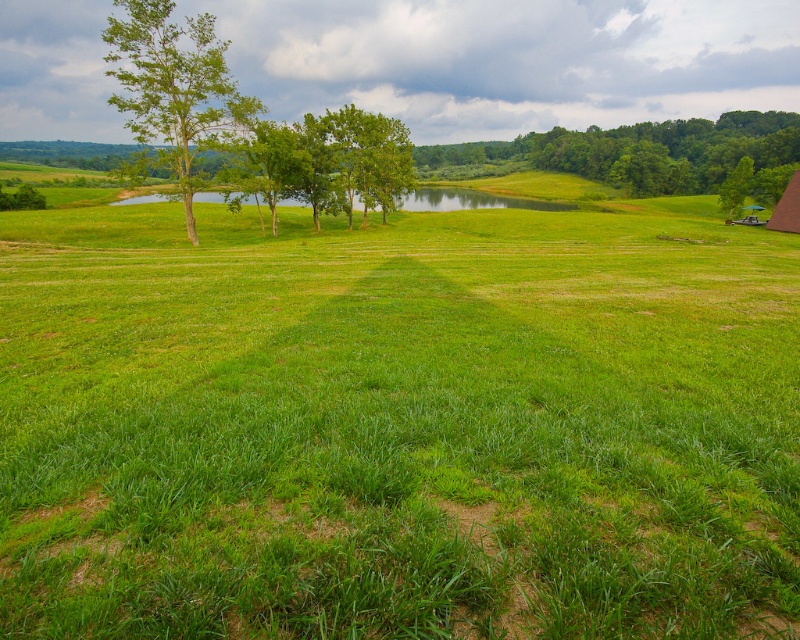
Can you confirm if green grassy field at center is positioned to the left of green canvas tent at right?

Indeed, green grassy field at center is positioned on the left side of green canvas tent at right.

Does green grassy field at center appear over green canvas tent at right?

No.

Between point (548, 436) and point (792, 192), which one is positioned behind?

The point (792, 192) is behind.

Image resolution: width=800 pixels, height=640 pixels. In order to click on green grassy field at center in this screenshot , I will do `click(398, 426)`.

Can you confirm if green leafy tree at left is taller than green leafy tree at upper right?

Correct, green leafy tree at left is much taller as green leafy tree at upper right.

Locate an element on the screen. green leafy tree at left is located at coordinates (174, 88).

Can you confirm if green leafy tree at left is positioned above green canvas tent at right?

Yes, green leafy tree at left is above green canvas tent at right.

Is green leafy tree at left shorter than green canvas tent at right?

In fact, green leafy tree at left may be taller than green canvas tent at right.

The height and width of the screenshot is (640, 800). I want to click on green leafy tree at left, so click(174, 88).

Where is `green leafy tree at left`? Image resolution: width=800 pixels, height=640 pixels. green leafy tree at left is located at coordinates (174, 88).